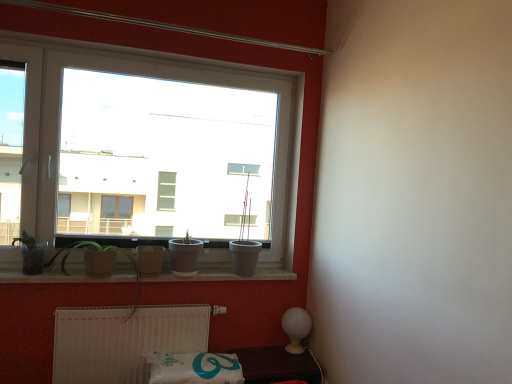
Locate an element on the screen. Image resolution: width=512 pixels, height=384 pixels. free space above white glossy lamp at lower right (from a real-world perspective) is located at coordinates (276, 359).